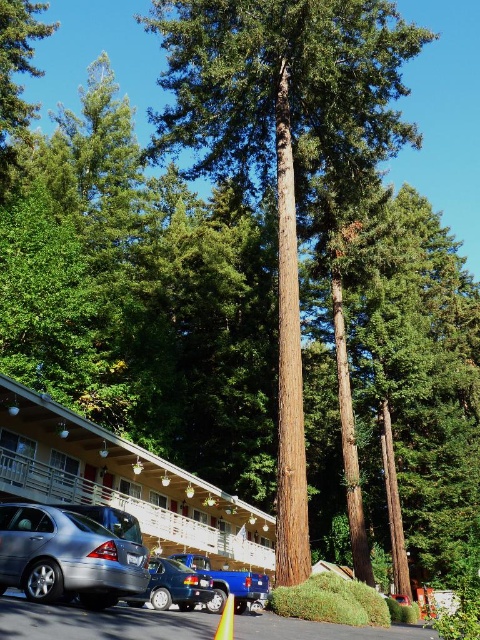
Question: In this image, where is white matte hotel at lower left located relative to yellow reflective plastic traffic cone at lower center?

Choices:
 (A) above
 (B) below

Answer: (B)

Question: Which object is farther from the camera taking this photo?

Choices:
 (A) satin silver car at lower left
 (B) blue metallic truck at lower center
 (C) white matte hotel at lower left

Answer: (C)

Question: Which point appears closest to the camera in this image?

Choices:
 (A) (257, 541)
 (B) (231, 624)
 (C) (152, 573)
 (D) (25, 512)

Answer: (B)

Question: In this image, where is satin silver car at lower left located relative to blue metallic truck at lower center?

Choices:
 (A) left
 (B) right

Answer: (A)

Question: Does brown rough textured tree at center have a larger size compared to yellow reflective plastic traffic cone at lower center?

Choices:
 (A) no
 (B) yes

Answer: (B)

Question: Based on their relative distances, which object is nearer to the blue metallic truck at lower center?

Choices:
 (A) brown rough textured tree at center
 (B) white matte hotel at lower left
 (C) metallic blue sedan at lower center

Answer: (C)